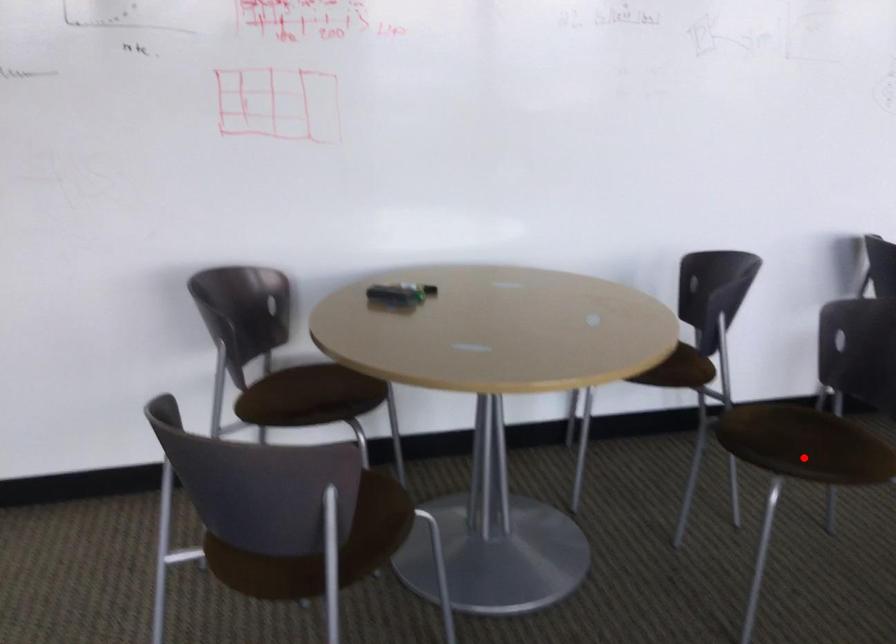
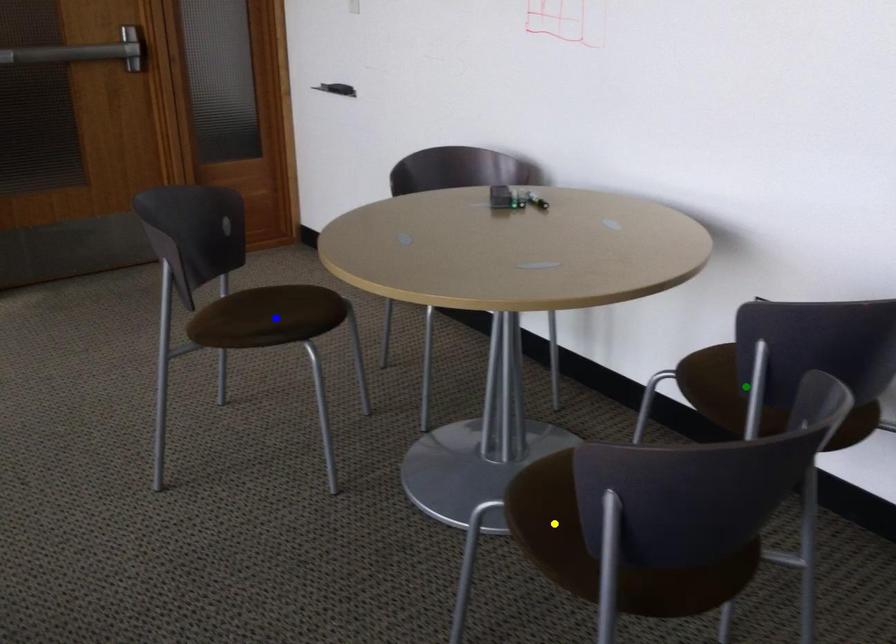
Question: I am providing you with two images of the same scene from different viewpoints. A red point is marked on the first image. You are given multiple points on the second image. In image 2, which mark is for the same physical point as the one in image 1?

Choices:
 (A) yellow point
 (B) green point
 (C) blue point

Answer: (A)